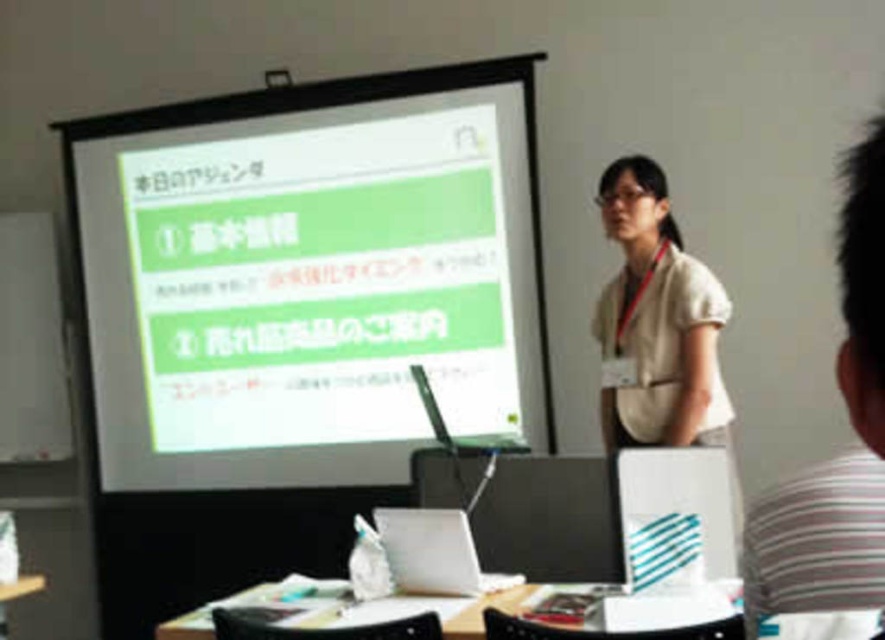
Question: Where is white matte laptop at center located in relation to wooden table at lower center in the image?

Choices:
 (A) left
 (B) right

Answer: (A)

Question: Which object appears farthest from the camera in this image?

Choices:
 (A) beige fabric shirt at center
 (B) striped cotton shirt at right

Answer: (A)

Question: Which of the following is the closest to the observer?

Choices:
 (A) (635, 157)
 (B) (451, 621)
 (C) (376, 168)

Answer: (B)

Question: Can you confirm if white matte projection screen at upper center is thinner than beige fabric shirt at center?

Choices:
 (A) yes
 (B) no

Answer: (B)

Question: Considering the relative positions of white matte projection screen at upper center and white matte laptop at center in the image provided, where is white matte projection screen at upper center located with respect to white matte laptop at center?

Choices:
 (A) above
 (B) below

Answer: (A)

Question: Which object appears farthest from the camera in this image?

Choices:
 (A) wooden table at lower center
 (B) beige fabric shirt at center
 (C) silver metallic laptop at center
 (D) striped cotton shirt at right

Answer: (C)